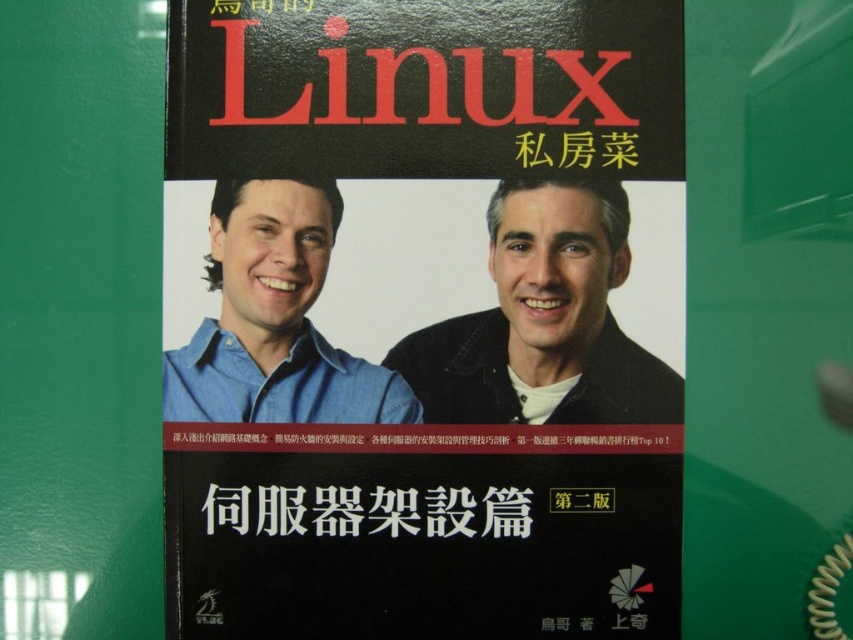
Does black matte book cover at center appear under matte black shirt at center?

No, black matte book cover at center is not below matte black shirt at center.

Who is lower down, black matte book cover at center or matte black shirt at center?

Positioned lower is matte black shirt at center.

Is point (251, 387) more distant than point (506, 307)?

That is False.

The height and width of the screenshot is (640, 853). I want to click on black matte book cover at center, so click(x=422, y=317).

Does point (631, 420) come closer to viewer compared to point (286, 508)?

No, (631, 420) is behind (286, 508).

Can you confirm if matte black shirt at center is thinner than black matte text at center?

Indeed, matte black shirt at center has a lesser width compared to black matte text at center.

Measure the distance between matte black shirt at center and camera.

matte black shirt at center is 85.92 centimeters from camera.

Find the location of a particular element. matte black shirt at center is located at coordinates (544, 321).

Who is more distant from viewer, (480, 378) or (321, 236)?

The point (321, 236) is more distant.

Between matte black shirt at center and blue denim shirt at left, which one is positioned higher?

blue denim shirt at left is above.

At what (x,y) coordinates should I click in order to perform the action: click on matte black shirt at center. Please return your answer as a coordinate pair (x, y). Looking at the image, I should click on (544, 321).

Locate an element on the screen. Image resolution: width=853 pixels, height=640 pixels. matte black shirt at center is located at coordinates (544, 321).